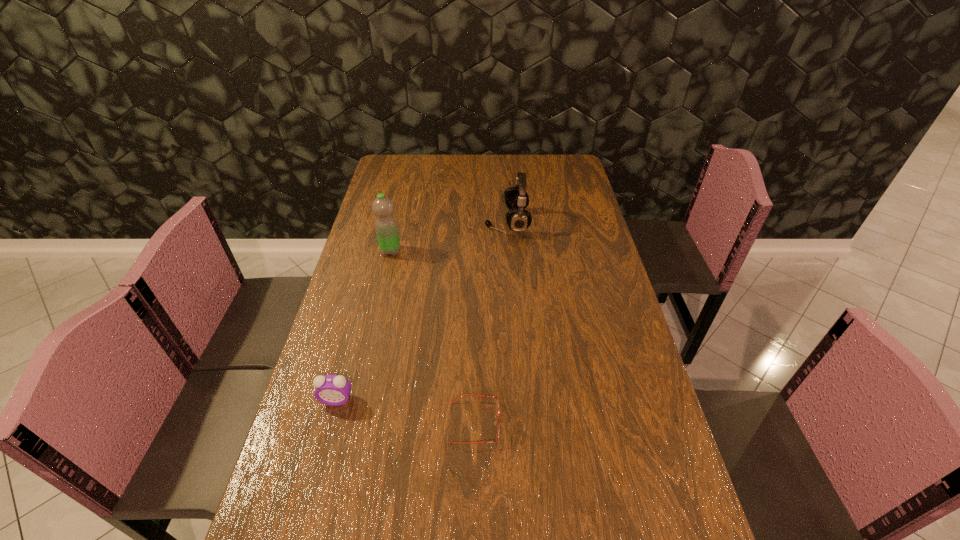
Find the location of a particular element. The width and height of the screenshot is (960, 540). free space between the farthest object and the spectacles is located at coordinates (492, 323).

The image size is (960, 540). What are the coordinates of `free space between the third nearest object and the farthest object` in the screenshot? It's located at (449, 237).

Locate an element on the screen. vacant space that is in between the alarm clock and the water bottle is located at coordinates (364, 326).

You are a GUI agent. You are given a task and a screenshot of the screen. Output one action in this format:
    pyautogui.click(x=<x>, y=<y>)
    Task: Click on the free space between the farthest object and the second farthest object
    This screenshot has height=540, width=960.
    Given the screenshot: What is the action you would take?
    pyautogui.click(x=449, y=237)

Where is `free space between the shortest object and the third nearest object`? free space between the shortest object and the third nearest object is located at coordinates (433, 337).

At what (x,y) coordinates should I click in order to perform the action: click on free spot between the third tallest object and the water bottle. Please return your answer as a coordinate pair (x, y). Looking at the image, I should click on (364, 326).

Identify the location of free point between the water bottle and the headset. (449, 237).

Locate an element on the screen. The height and width of the screenshot is (540, 960). object that ranks as the third closest to the water bottle is located at coordinates (497, 402).

Identify which object is the second nearest to the shortest object. Please provide its 2D coordinates. Your answer should be formatted as a tuple, i.e. [(x, y)], where the tuple contains the x and y coordinates of a point satisfying the conditions above.

[(386, 228)]

Identify the location of blank space that satisfies the following two spatial constraints: 1. with the microphone on the side of the headset; 2. on the face of the second shortest object. The image size is (960, 540). (520, 400).